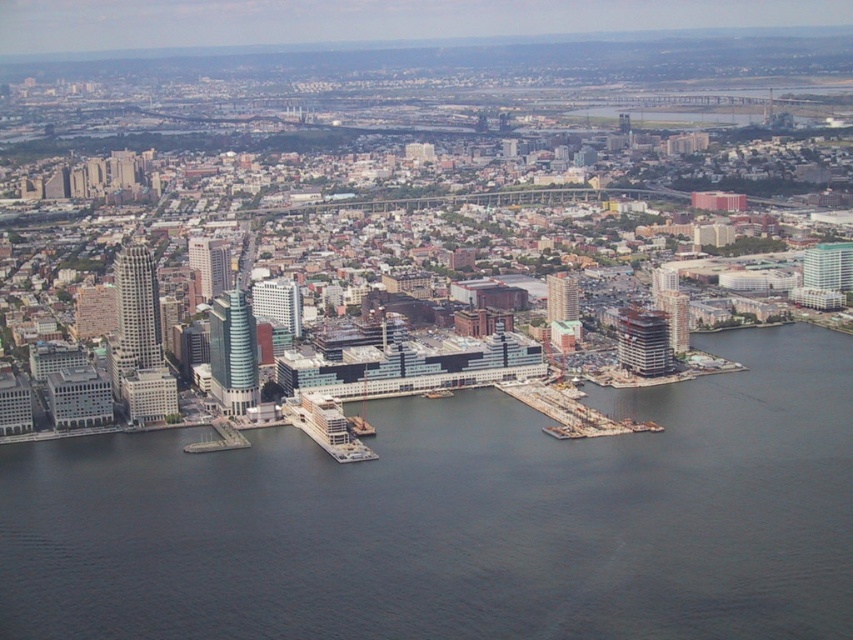
You are a delivery drone flying over the city and need to land on a pier that is exactly 2062.13 feet away from the dark blue water at center. Is there a pier at that distance?

The dark blue water at center is 2062.13 feet apart from the pier, so yes, there is a pier at that distance.

You are a delivery drone that needs to land on the wooden planks dock at lower right. You are currently hovering 10 meters above the dark blue water at center. What is the minimum vertical distance you need to descend to reach the dock?

The minimum vertical distance you need to descend is 10 meters because you are currently 10 meters above the dark blue water at center, and the dock is at the same elevation as the water surface. Therefore, descending 10 meters will bring you to the dock level.

You are a delivery drone flying over the city and need to land on one of the two docks. The wooden planks dock at lower right and the concrete dock at lower left are both visible. Which dock is positioned higher relative to the other?

The wooden planks dock at lower right is located above the concrete dock at lower left, so it is positioned higher.